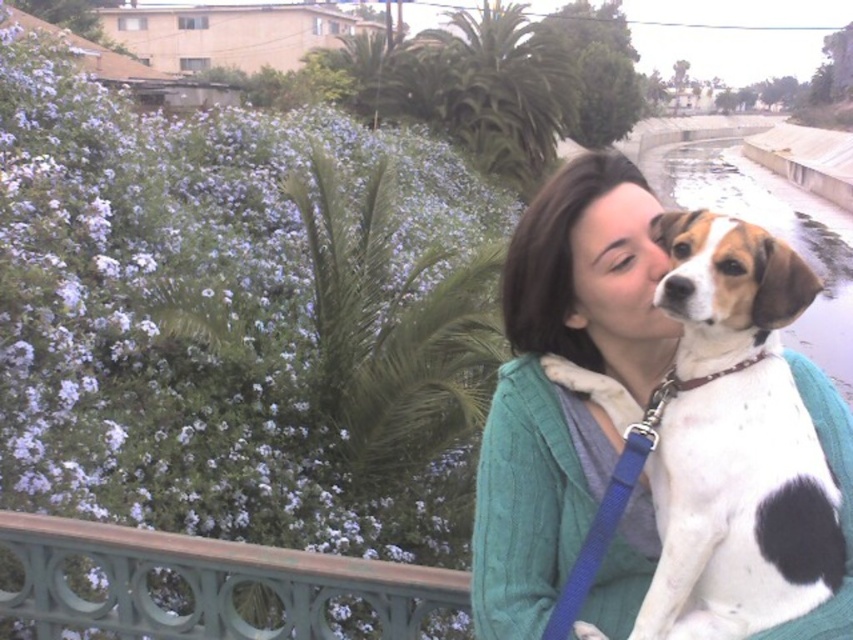
You are designing a garden layout and need to place a new bench. The bench must be placed between the purple matte flowers at upper left and the green painted metal railing at lower left. Which object should the bench be closer to?

The bench should be placed closer to the green painted metal railing at lower left because the purple matte flowers at upper left is located below it, meaning the railing is above the flowers in the scene.